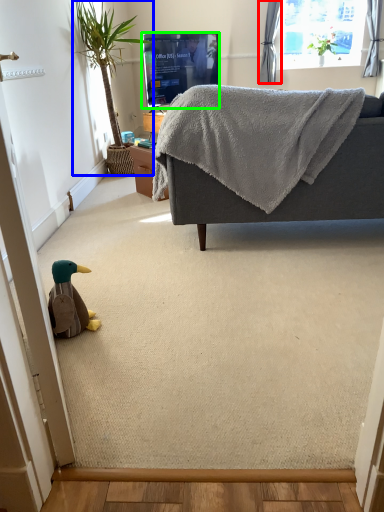
Question: Which object is positioned closest to curtain (highlighted by a red box)? Select from houseplant (highlighted by a blue box) and television (highlighted by a green box).

Choices:
 (A) houseplant
 (B) television

Answer: (B)